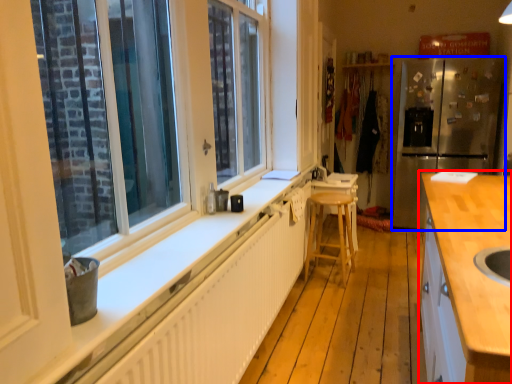
Question: Which point is closer to the camera, cabinetry (highlighted by a red box) or refrigerator (highlighted by a blue box)?

Choices:
 (A) cabinetry
 (B) refrigerator

Answer: (A)